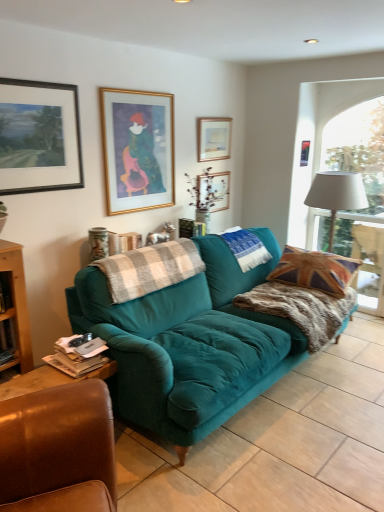
Question: Is union jack fabric pillow at right at the left side of teal velvet sofa at center?

Choices:
 (A) no
 (B) yes

Answer: (A)

Question: Considering the relative sizes of union jack fabric pillow at right and teal velvet sofa at center in the image provided, is union jack fabric pillow at right thinner than teal velvet sofa at center?

Choices:
 (A) yes
 (B) no

Answer: (A)

Question: Is union jack fabric pillow at right shorter than teal velvet sofa at center?

Choices:
 (A) no
 (B) yes

Answer: (A)

Question: Considering the relative sizes of union jack fabric pillow at right and teal velvet sofa at center in the image provided, is union jack fabric pillow at right taller than teal velvet sofa at center?

Choices:
 (A) no
 (B) yes

Answer: (B)

Question: From the image's perspective, is union jack fabric pillow at right over teal velvet sofa at center?

Choices:
 (A) no
 (B) yes

Answer: (B)

Question: Is union jack fabric pillow at right positioned behind teal velvet sofa at center?

Choices:
 (A) yes
 (B) no

Answer: (A)

Question: Is matte black picture frame at upper left, acting as the 1th picture frame starting from the left, looking in the opposite direction of fuzzy brown blanket at right, which ranks as the first blanket in right-to-left order?

Choices:
 (A) yes
 (B) no

Answer: (B)

Question: Can you confirm if matte black picture frame at upper left, the 5th picture frame in the right-to-left sequence, is bigger than fuzzy brown blanket at right, which ranks as the first blanket in right-to-left order?

Choices:
 (A) no
 (B) yes

Answer: (A)

Question: Is matte black picture frame at upper left, acting as the 1th picture frame starting from the left, positioned in front of fuzzy brown blanket at right, which ranks as the first blanket in right-to-left order?

Choices:
 (A) no
 (B) yes

Answer: (B)

Question: From the image's perspective, is matte black picture frame at upper left, the 5th picture frame in the right-to-left sequence, on fuzzy brown blanket at right, arranged as the third blanket when viewed from the left?

Choices:
 (A) yes
 (B) no

Answer: (A)

Question: Is matte black picture frame at upper left, the 5th picture frame in the right-to-left sequence, not close to fuzzy brown blanket at right, which ranks as the first blanket in right-to-left order?

Choices:
 (A) no
 (B) yes

Answer: (B)

Question: Is matte black picture frame at upper left, acting as the 1th picture frame starting from the left, facing towards fuzzy brown blanket at right, arranged as the third blanket when viewed from the left?

Choices:
 (A) no
 (B) yes

Answer: (A)

Question: Does teal velvet sofa at center have a lesser width compared to plaid wool blanket at center, the third blanket in the right-to-left sequence?

Choices:
 (A) no
 (B) yes

Answer: (A)